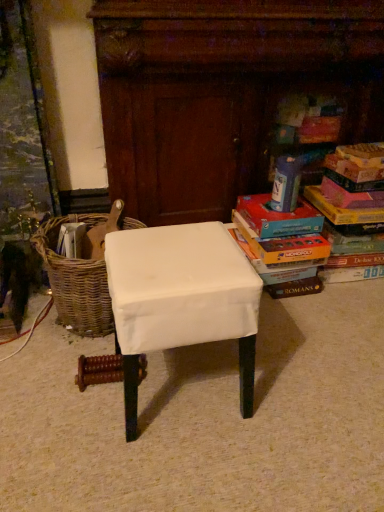
Where is `vacant space to the right of white fabric-covered stool at center`? Image resolution: width=384 pixels, height=512 pixels. vacant space to the right of white fabric-covered stool at center is located at coordinates (292, 389).